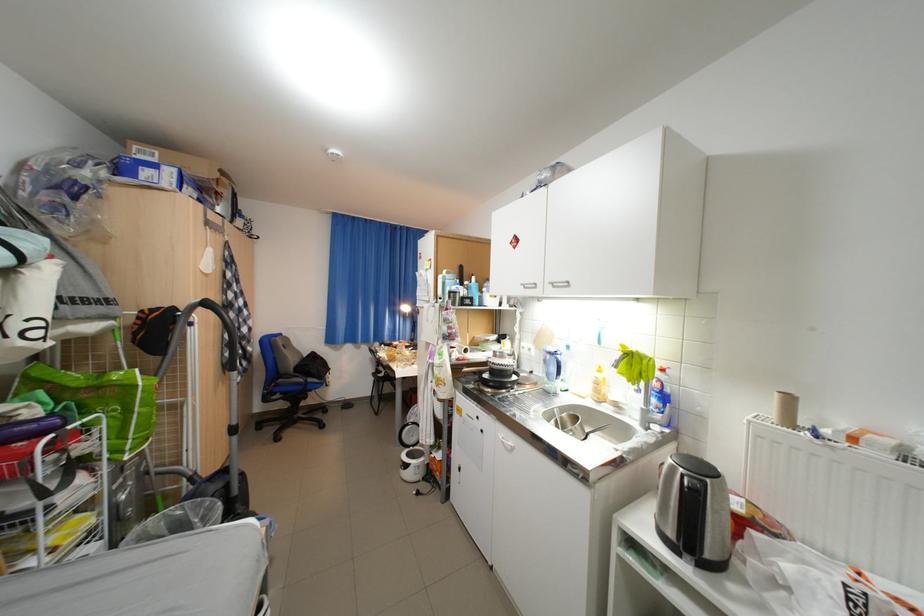
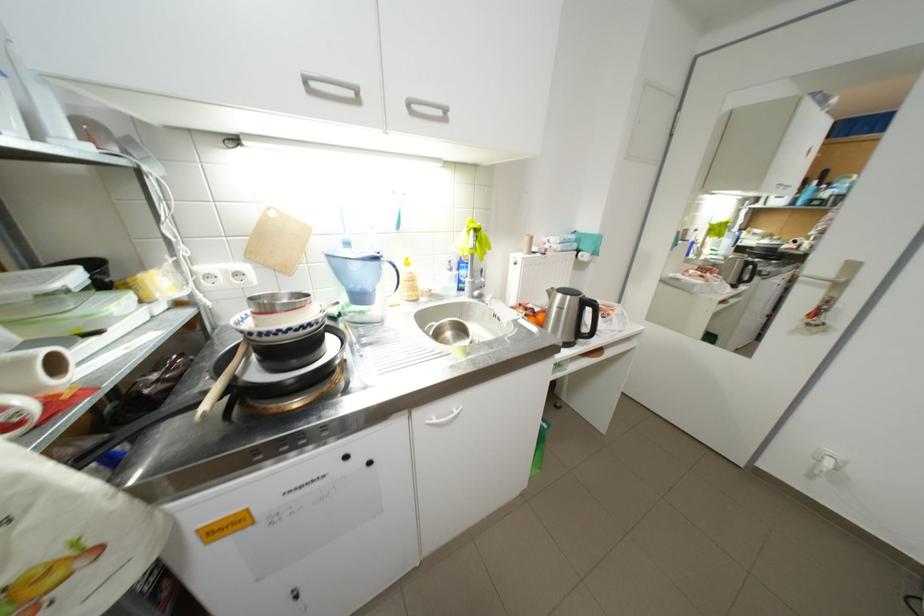
Where in the second image is the point corresponding to point (564, 285) from the first image?

(420, 105)